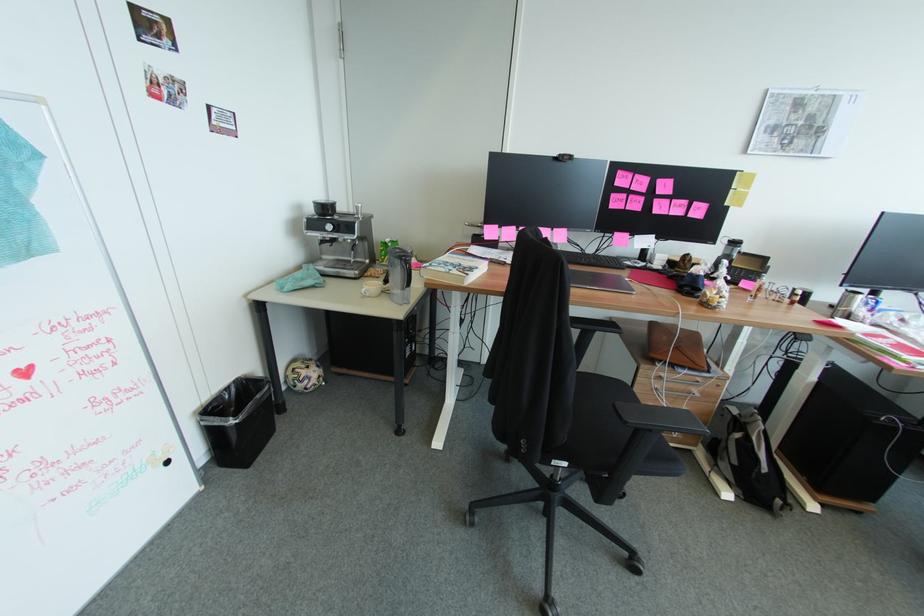
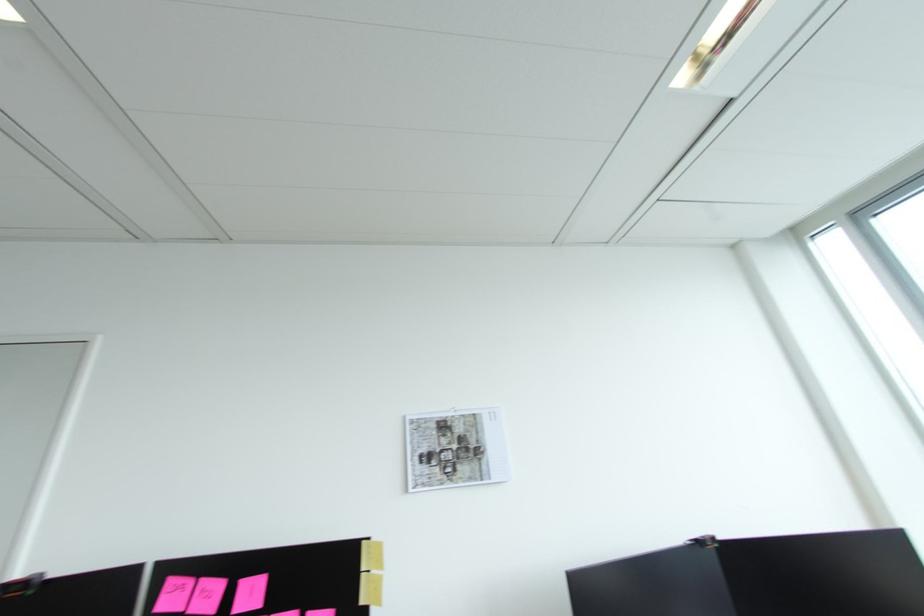
In the second image, find the point that corresponds to point (732, 204) in the first image.

(366, 602)